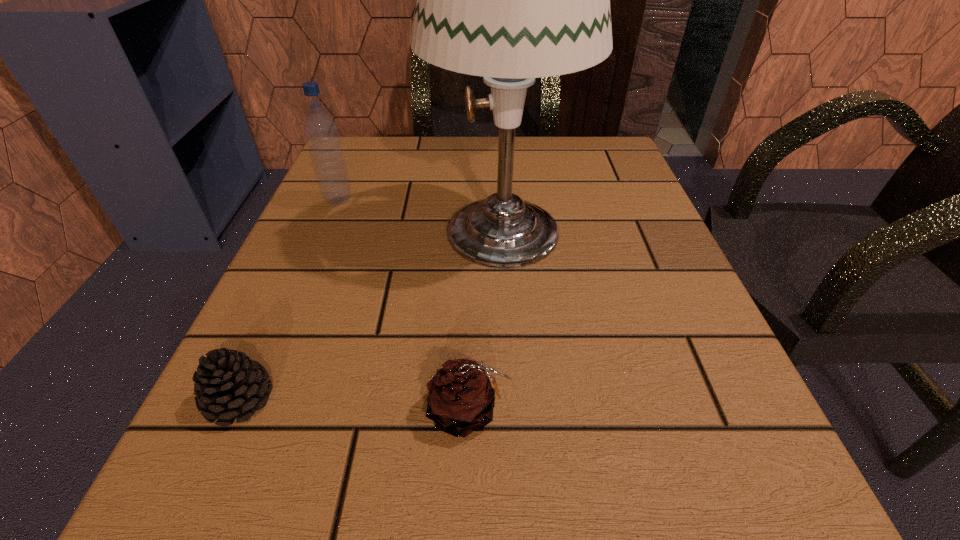
Image resolution: width=960 pixels, height=540 pixels. In the image, there is a desktop. In order to click on vacant space at the near right corner in this screenshot , I will do `click(681, 510)`.

Identify the location of unoccupied area between the tallest object and the right pinecone. click(x=487, y=320).

The height and width of the screenshot is (540, 960). In order to click on vacant space that is in between the water bottle and the left pinecone in this screenshot , I will do `click(290, 300)`.

Where is `vacant region between the tallest object and the right pinecone`? vacant region between the tallest object and the right pinecone is located at coordinates (487, 320).

Locate an element on the screen. The height and width of the screenshot is (540, 960). free area in between the lampshade and the right pinecone is located at coordinates (487, 320).

The width and height of the screenshot is (960, 540). Identify the location of free space that is in between the left pinecone and the water bottle. (290, 300).

Find the location of a particular element. The image size is (960, 540). free space between the right pinecone and the left pinecone is located at coordinates (355, 406).

Locate an element on the screen. Image resolution: width=960 pixels, height=540 pixels. free space between the water bottle and the right pinecone is located at coordinates pos(404,306).

The image size is (960, 540). Identify the location of free space between the left pinecone and the third shortest object. (290, 300).

You are a GUI agent. You are given a task and a screenshot of the screen. Output one action in this format:
    pyautogui.click(x=<x>, y=<y>)
    Task: Click on the vacant space that is in between the third shortest object and the tallest object
    This screenshot has height=540, width=960.
    Given the screenshot: What is the action you would take?
    pyautogui.click(x=420, y=215)